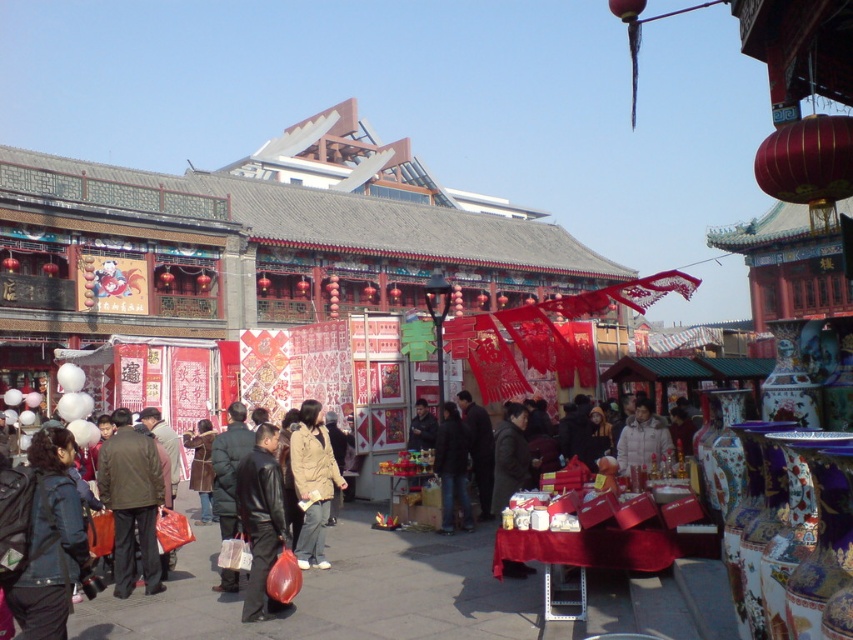
Question: Which point is farther to the camera?

Choices:
 (A) (160, 492)
 (B) (50, 444)
 (C) (450, 483)

Answer: (C)

Question: Is the position of dark brown leather jacket at center more distant than that of leather jacket at center?

Choices:
 (A) yes
 (B) no

Answer: (A)

Question: Which of the following is the farthest from the observer?

Choices:
 (A) black leather jacket at center
 (B) leather jacket at center

Answer: (A)

Question: Which object appears farthest from the camera in this image?

Choices:
 (A) dark blue leather jacket at lower left
 (B) white matte jacket at center
 (C) black leather jacket at center

Answer: (B)

Question: Is leather jacket at center above white matte jacket at center?

Choices:
 (A) no
 (B) yes

Answer: (A)

Question: Can you confirm if dark blue leather jacket at lower left is positioned to the right of dark brown leather jacket at center?

Choices:
 (A) yes
 (B) no

Answer: (A)